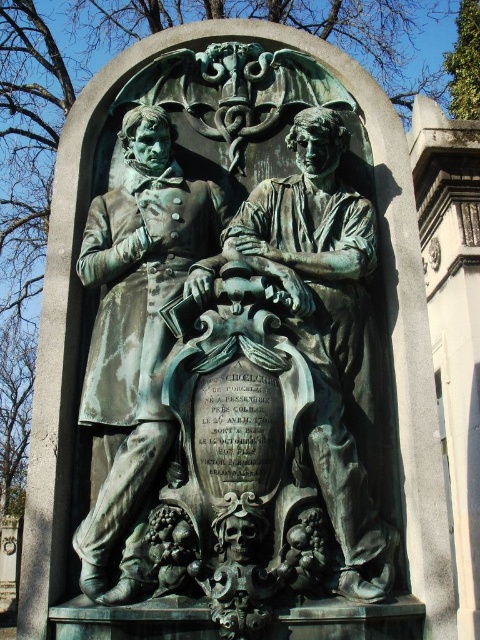
Question: Does bronze statue at center appear on the left side of green patina statue at left?

Choices:
 (A) yes
 (B) no

Answer: (B)

Question: Which object is farther from the camera taking this photo?

Choices:
 (A) green patina statue at left
 (B) bronze statue at center

Answer: (A)

Question: Which object appears farthest from the camera in this image?

Choices:
 (A) green patina statue at left
 (B) bronze statue at center

Answer: (A)

Question: Can you confirm if bronze statue at center is positioned to the right of green patina statue at left?

Choices:
 (A) yes
 (B) no

Answer: (A)

Question: Is bronze statue at center in front of green patina statue at left?

Choices:
 (A) no
 (B) yes

Answer: (B)

Question: Which of the following is the closest to the observer?

Choices:
 (A) (103, 440)
 (B) (88, 257)

Answer: (A)